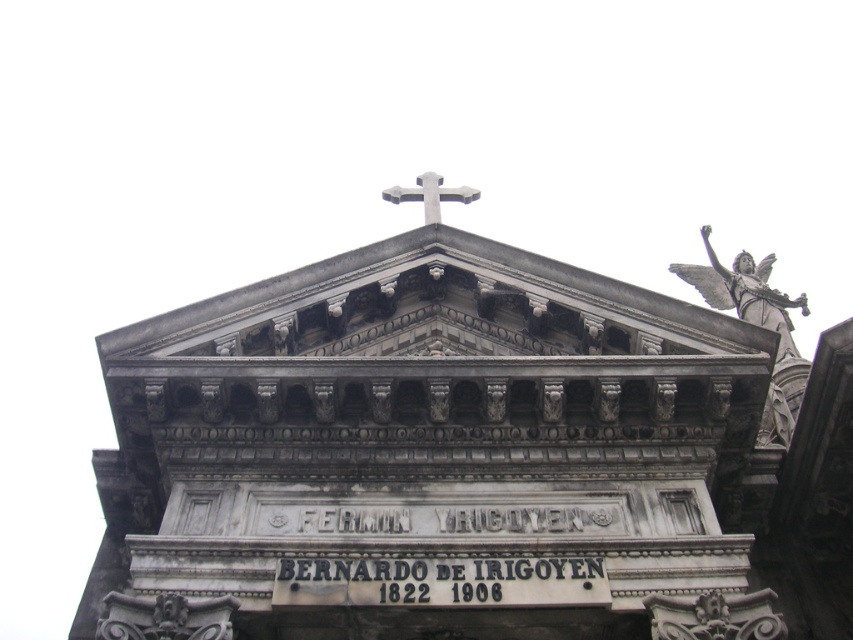
Question: Which point is farther to the camera?

Choices:
 (A) (459, 192)
 (B) (187, 598)

Answer: (A)

Question: Can you confirm if gray stone church at center is positioned above metallic cross at center?

Choices:
 (A) no
 (B) yes

Answer: (A)

Question: Which point is closer to the camera?

Choices:
 (A) (374, 433)
 (B) (433, 180)

Answer: (A)

Question: Is gray stone church at center thinner than metallic cross at center?

Choices:
 (A) no
 (B) yes

Answer: (A)

Question: Which point is farther to the camera?

Choices:
 (A) (405, 188)
 (B) (764, 532)

Answer: (A)

Question: Can you confirm if gray stone church at center is positioned to the right of metallic cross at center?

Choices:
 (A) yes
 (B) no

Answer: (A)